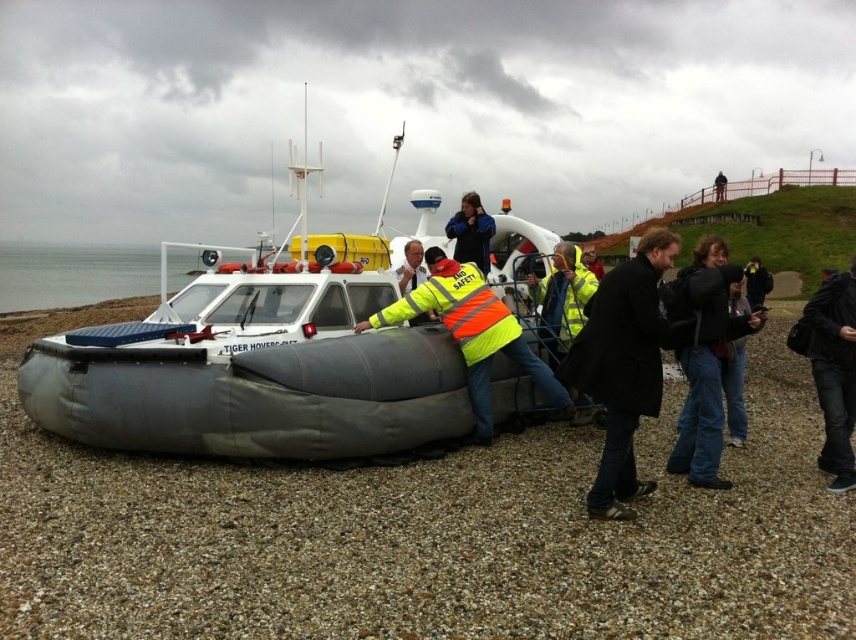
Is gray rubber hovercraft at center to the right of black matte coat at center from the viewer's perspective?

Incorrect, gray rubber hovercraft at center is not on the right side of black matte coat at center.

Is point (411, 445) more distant than point (646, 486)?

That is True.

I want to click on gray rubber hovercraft at center, so click(x=257, y=365).

Who is lower down, gray rubber hovercraft at center or high-visibility fabric safety vest at center?

Positioned lower is gray rubber hovercraft at center.

Consider the image. Who is more forward, (67, 344) or (489, 413)?

Point (67, 344) is more forward.

The height and width of the screenshot is (640, 856). Identify the location of gray rubber hovercraft at center. (257, 365).

Which is more to the left, black matte coat at center or high-visibility fabric safety vest at center?

high-visibility fabric safety vest at center is more to the left.

Between point (652, 273) and point (477, 385), which one is positioned in front?

Point (652, 273) is more forward.

Where is `black matte coat at center`? The height and width of the screenshot is (640, 856). black matte coat at center is located at coordinates (623, 365).

Locate an element on the screen. The image size is (856, 640). black matte coat at center is located at coordinates (623, 365).